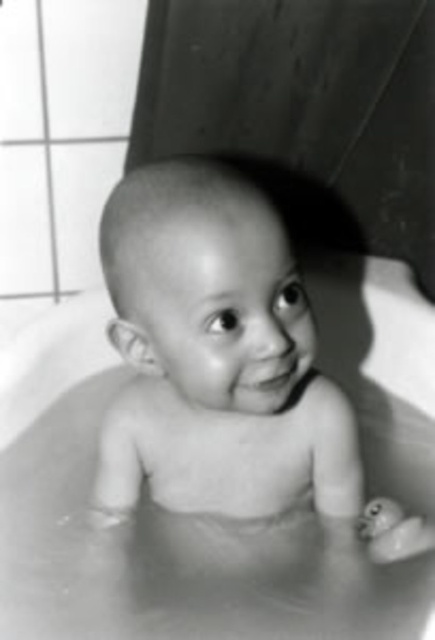
Question: Is smooth rubber bath at center thinner than smooth skin baby at center?

Choices:
 (A) yes
 (B) no

Answer: (B)

Question: Can you confirm if smooth rubber bath at center is positioned above smooth skin baby at center?

Choices:
 (A) no
 (B) yes

Answer: (A)

Question: Which point is closer to the camera taking this photo?

Choices:
 (A) (181, 461)
 (B) (149, 595)

Answer: (B)

Question: Which of the following is the farthest from the observer?

Choices:
 (A) (333, 339)
 (B) (256, 372)

Answer: (A)

Question: Is smooth rubber bath at center below smooth skin baby at center?

Choices:
 (A) yes
 (B) no

Answer: (A)

Question: Among these objects, which one is nearest to the camera?

Choices:
 (A) smooth rubber bath at center
 (B) smooth skin baby at center

Answer: (A)